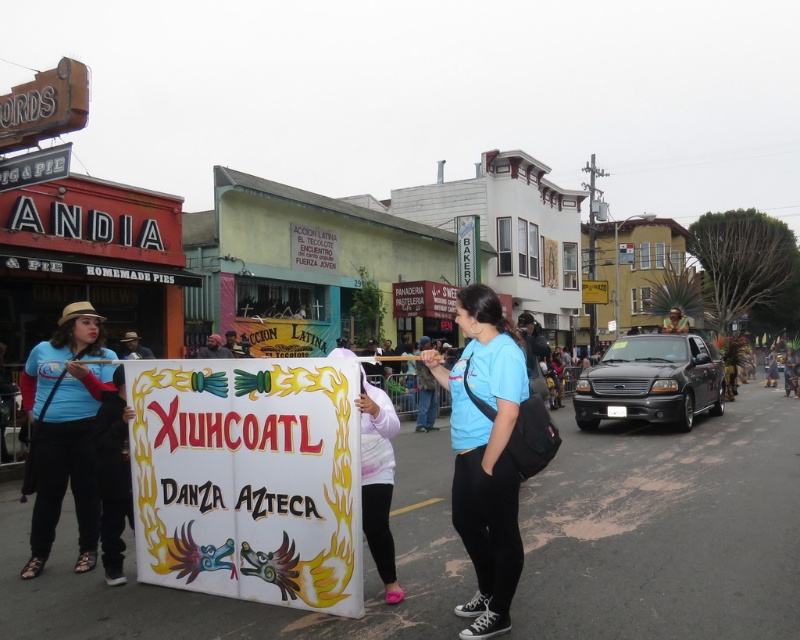
You are organizing a cultural event and need to choose between the white fabric sign at center and the white matte sign at center for better visibility. Which one is bigger?

The white fabric sign at center is larger than the white matte sign at center, so it would be better for visibility.